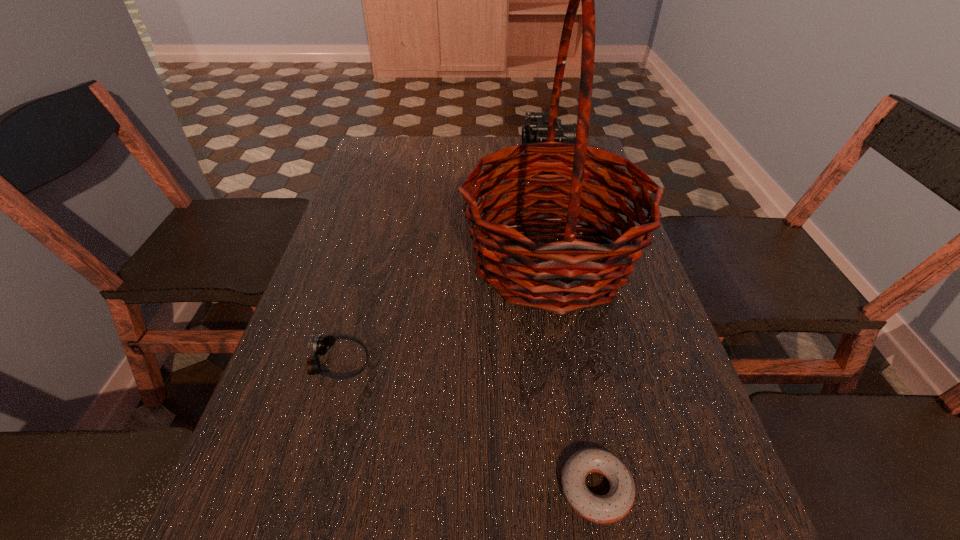
Identify the location of object at the far right corner. The height and width of the screenshot is (540, 960). (536, 131).

The height and width of the screenshot is (540, 960). What are the coordinates of `blank space at the far edge of the desktop` in the screenshot? It's located at (468, 164).

Locate an element on the screen. free spot at the left edge of the desktop is located at coordinates (329, 238).

You are a GUI agent. You are given a task and a screenshot of the screen. Output one action in this format:
    pyautogui.click(x=<x>, y=<y>)
    Task: Click on the vacant region at the right edge
    The height and width of the screenshot is (540, 960).
    Given the screenshot: What is the action you would take?
    pyautogui.click(x=669, y=404)

Image resolution: width=960 pixels, height=540 pixels. Find the location of `free region at the far left corner`. free region at the far left corner is located at coordinates (382, 153).

At what (x,y) coordinates should I click in order to perform the action: click on vacant area that lies between the doughnut and the leftmost object. Please return your answer as a coordinate pair (x, y). The height and width of the screenshot is (540, 960). Looking at the image, I should click on (468, 426).

The image size is (960, 540). What are the coordinates of `vacant space that's between the nearest object and the basket` in the screenshot? It's located at (573, 374).

Where is `free space between the doughnut and the basket`? free space between the doughnut and the basket is located at coordinates [x=573, y=374].

Where is `vacant space that is in between the nearest object and the second nearest object`? The width and height of the screenshot is (960, 540). vacant space that is in between the nearest object and the second nearest object is located at coordinates (468, 426).

Locate an element on the screen. The width and height of the screenshot is (960, 540). vacant area that lies between the tallest object and the leftmost object is located at coordinates (444, 312).